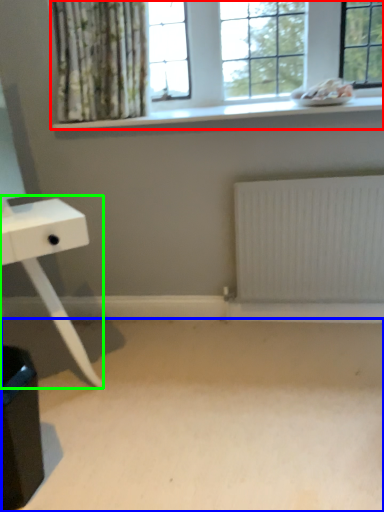
Question: Based on their relative distances, which object is nearer to window (highlighted by a red box)? Choose from plain (highlighted by a blue box) and table (highlighted by a green box).

Choices:
 (A) plain
 (B) table

Answer: (B)